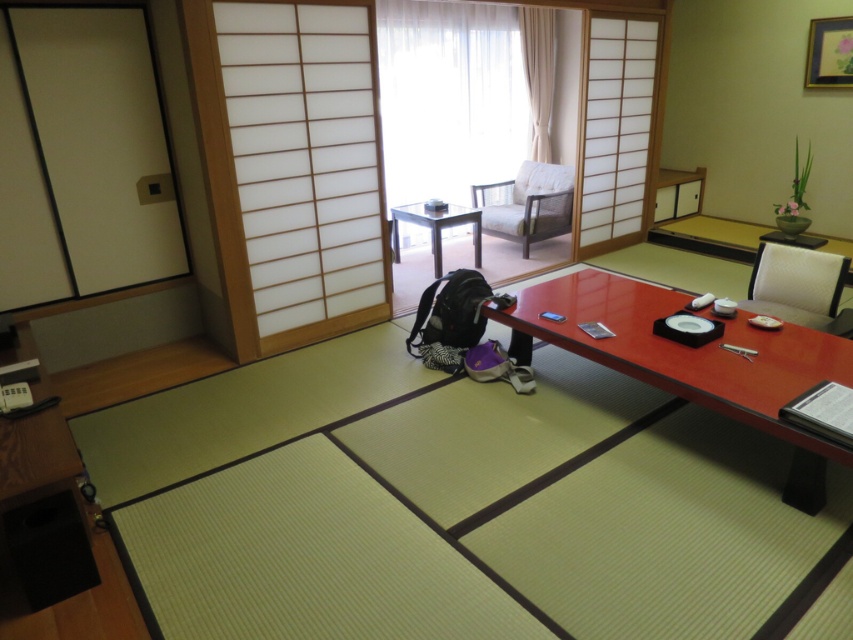
You are sitting in the light brown wood chair at upper center and want to reach the smooth red wooden table at center. Which direction should you move to get closer to the table?

You should move forward because the smooth red wooden table at center is in front of the light brown wood chair at upper center, so moving forward from the chair will bring you closer to the table.

You are a photographer standing in the middle of the room. You see the white fabric chair at right and a camera. Which object is closer to you?

The white fabric chair at right is closer to you than the camera since they are 10.38 feet apart.

You are standing in a traditional Japanese room with tatami flooring. You see two points marked on the floor. The first point is at coordinates point (833, 336) and the second is at point (520, 204). Which point is closer to you?

The point at coordinates point (833, 336) is closer to the viewer than point (520, 204).